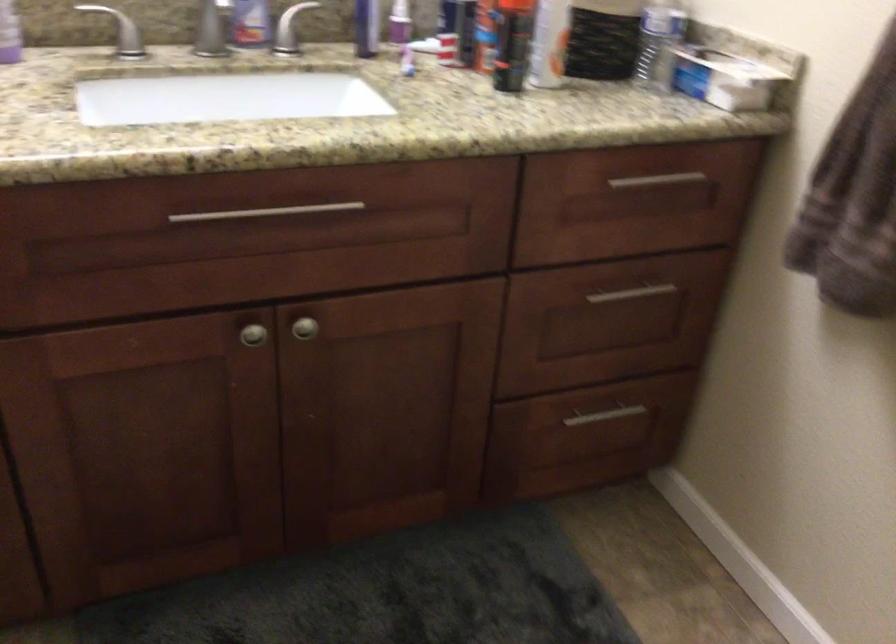
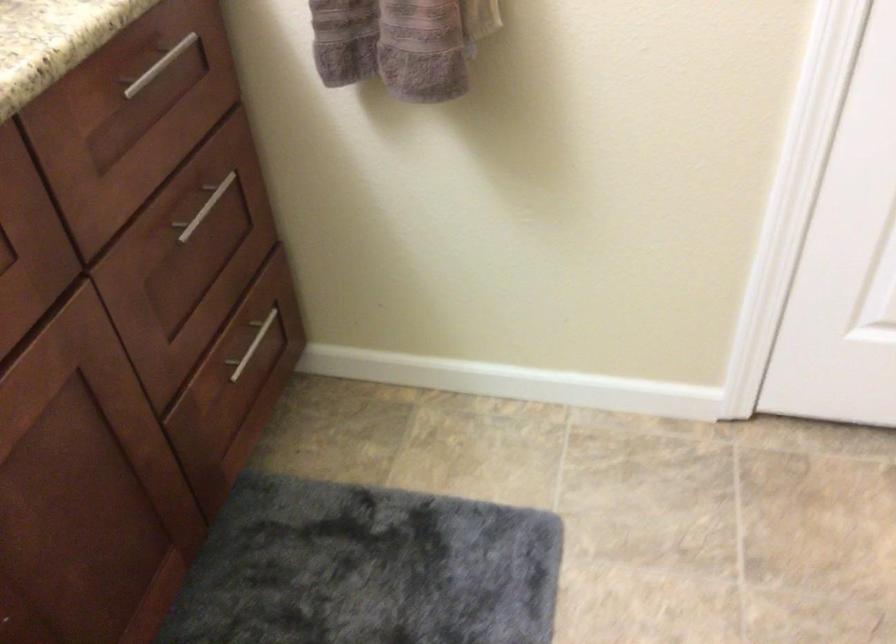
Where in the second image is the point corresponding to (625,292) from the first image?

(203, 207)